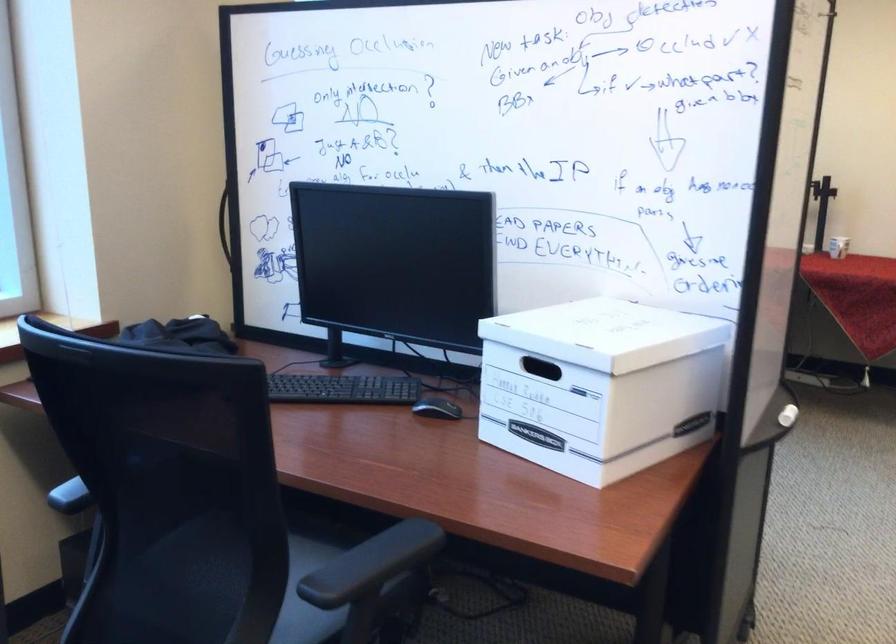
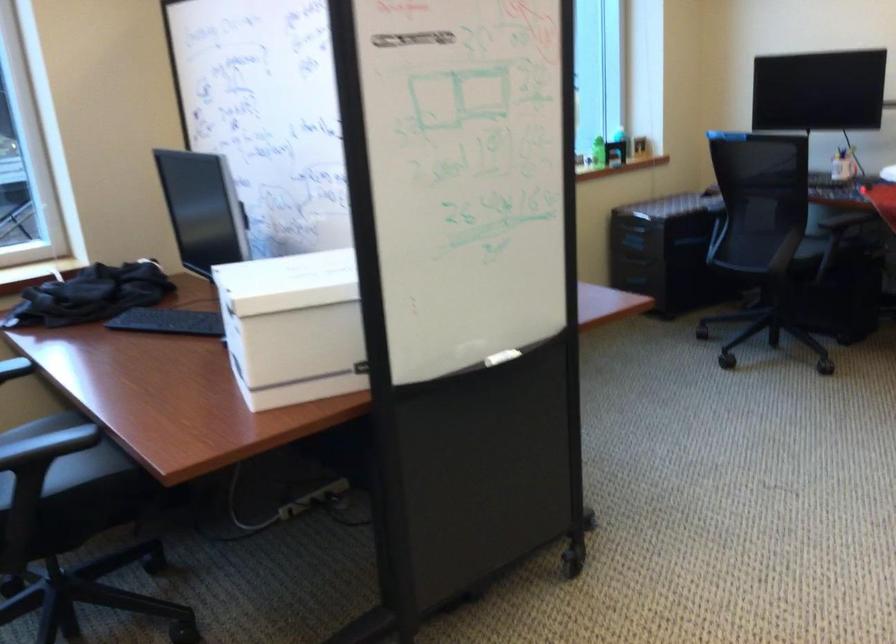
Question: In a continuous first-person perspective shot, in which direction is the camera moving?

Choices:
 (A) Left
 (B) Right
 (C) Forward
 (D) Backward

Answer: (B)